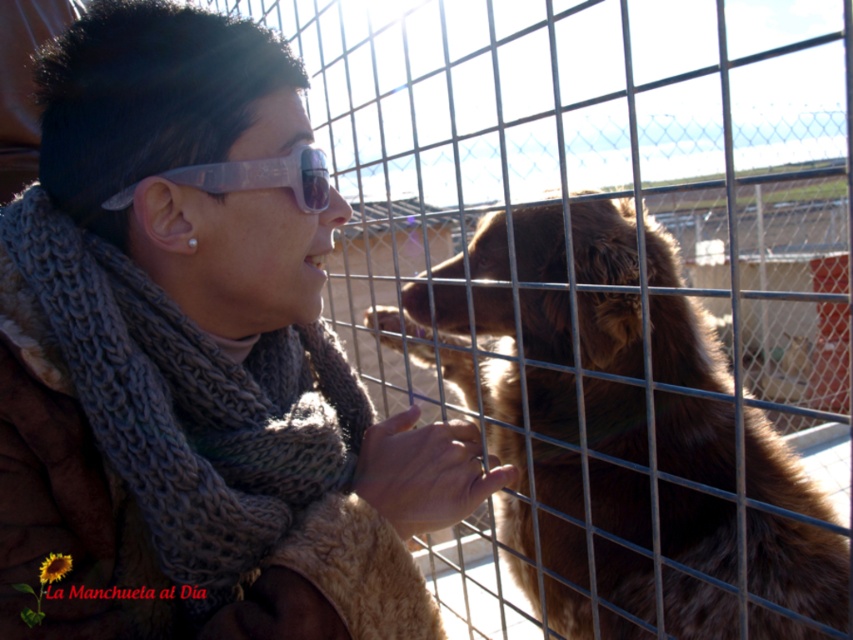
You are a fashion designer observing the knitted scarf at center and transparent plastic goggles at upper center in the image. Which item has a greater width?

The knitted scarf at center has a greater width than the transparent plastic goggles at upper center.

You are a photographer trying to capture a closeup of the knitted scarf at center and the brown furry dog at center. Which object should you zoom in on to ensure it fills the frame more without moving the camera?

The brown furry dog at center is wider than the knitted scarf at center, so you should zoom in on the brown furry dog at center to fill the frame more without moving the camera.